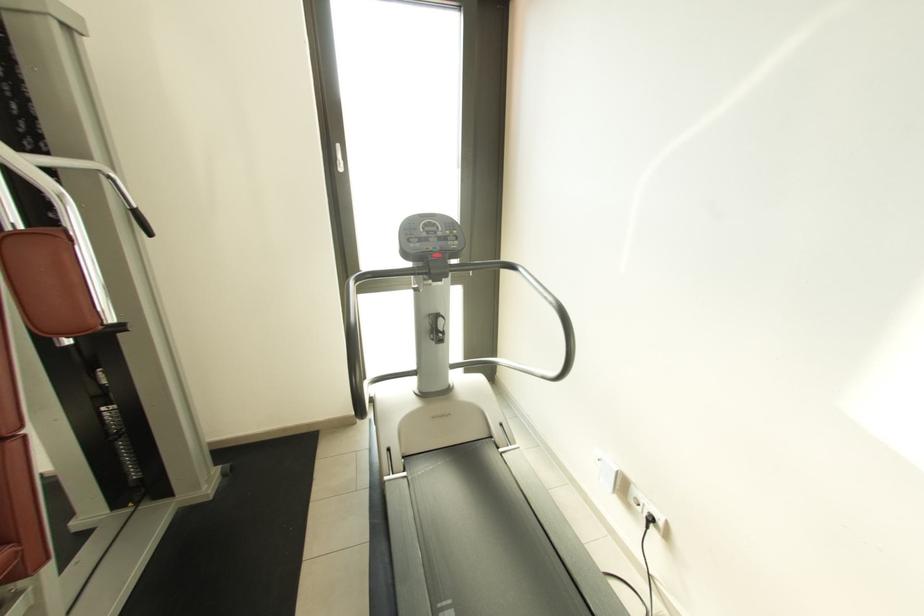
What are the coordinates of `black bottle holder` in the screenshot? It's located at (436, 328).